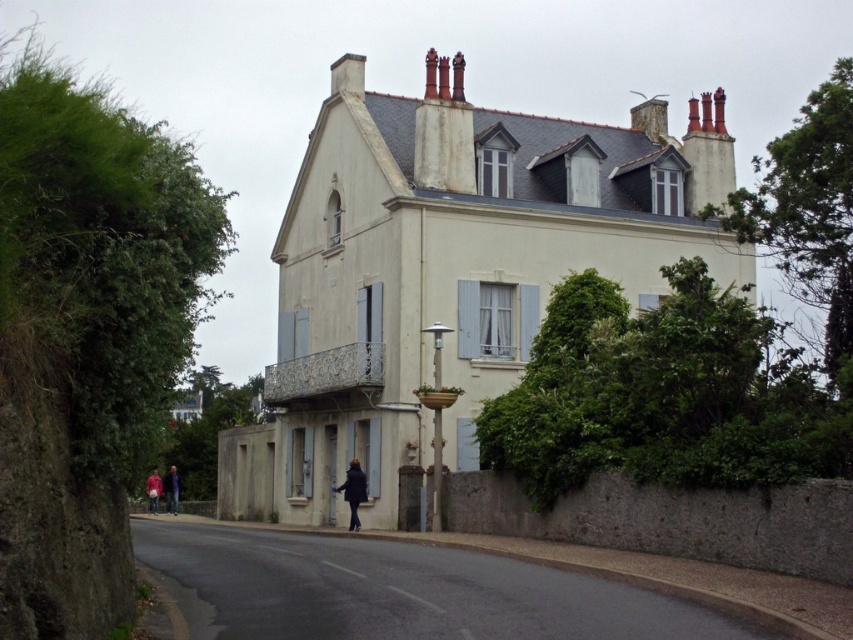
Question: Is black matte coat at lower center to the right of red fabric jacket at lower left from the viewer's perspective?

Choices:
 (A) yes
 (B) no

Answer: (A)

Question: Which object is farther from the camera taking this photo?

Choices:
 (A) black matte coat at lower center
 (B) blue fabric jacket at lower left

Answer: (B)

Question: Is blue fabric jacket at lower left wider than red fabric jacket at lower left?

Choices:
 (A) yes
 (B) no

Answer: (A)

Question: Which object appears farthest from the camera in this image?

Choices:
 (A) black matte coat at lower center
 (B) blue fabric jacket at lower left

Answer: (B)

Question: Does black matte coat at lower center have a smaller size compared to blue fabric jacket at lower left?

Choices:
 (A) yes
 (B) no

Answer: (A)

Question: Which of the following is the farthest from the observer?

Choices:
 (A) (170, 493)
 (B) (345, 492)
 (C) (148, 484)

Answer: (A)